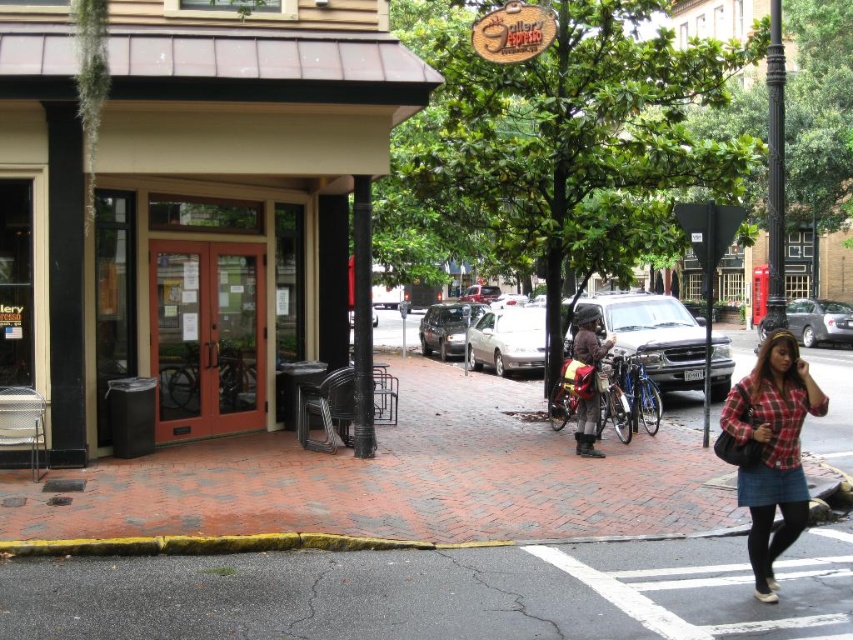
Question: Is silver metallic sedan at right thinner than satin black sedan at center?

Choices:
 (A) yes
 (B) no

Answer: (B)

Question: Can you confirm if matte black suv at center is wider than silver metallic sedan at center?

Choices:
 (A) no
 (B) yes

Answer: (B)

Question: Which of the following is the farthest from the observer?

Choices:
 (A) brown leather jacket at center
 (B) satin black sedan at center

Answer: (B)

Question: Considering the relative positions of matte black suv at center and satin black sedan at center in the image provided, where is matte black suv at center located with respect to satin black sedan at center?

Choices:
 (A) above
 (B) below

Answer: (B)

Question: Which point appears farthest from the camera in this image?

Choices:
 (A) coord(480,344)
 (B) coord(65,8)
 (C) coord(454,339)
 (D) coord(480,292)

Answer: (D)

Question: Among these objects, which one is nearest to the camera?

Choices:
 (A) satin black sedan at center
 (B) brown leather jacket at center
 (C) brown wood door at center

Answer: (C)